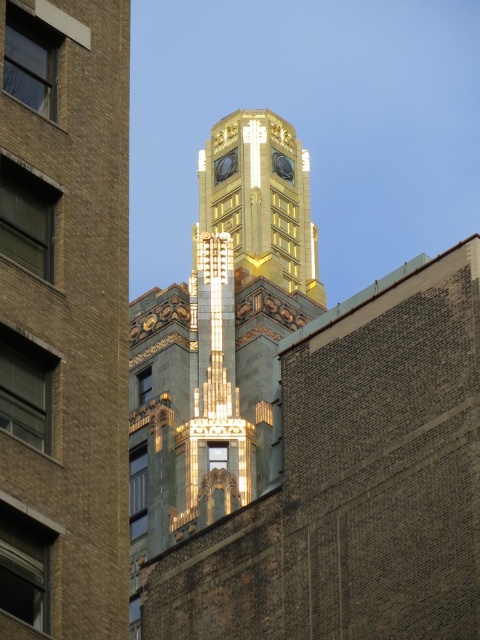
Which is behind, point (316, 269) or point (197, 449)?

Positioned behind is point (316, 269).

Describe the element at coordinates (260, 198) in the screenshot. I see `gold metallic clock tower at center` at that location.

Where is `gold metallic clock tower at center`? The width and height of the screenshot is (480, 640). gold metallic clock tower at center is located at coordinates (260, 198).